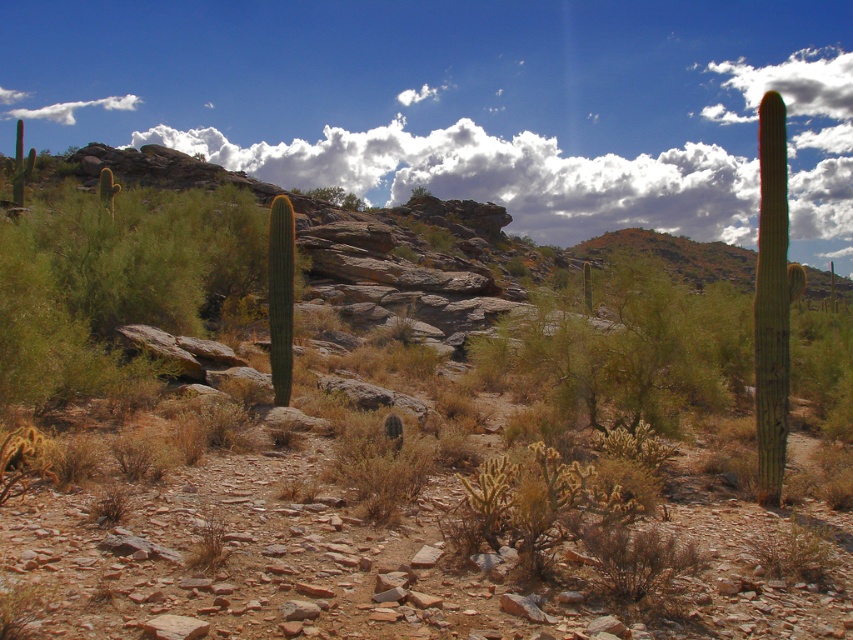
You are an astronomer observing the desert sky and notice two clouds, the white fluffy cloud at upper center and the white fluffy cloud at upper left. Which of these two clouds appears bigger in the sky?

The white fluffy cloud at upper center appears bigger because it is larger in size than the white fluffy cloud at upper left.

You are standing at the point marked by the coordinates point (163, 252) in the desert scene. Looking around, you see a large, slender saguaro cactus on the right side of the frame. What object is located at your current position?

The point (163, 252) corresponds to the green fuzzy cactus at center left.

You are standing in the desert and want to take a photo of the point at coordinates (173,288). Your camera has a maximum focus range of 20 meters. Will the camera be able to focus on the point?

Answer: The distance of point (173,288) from the camera is 22.25 meters, which exceeds the camera maximum focus range of 20 meters. The camera will not be able to focus on the point.